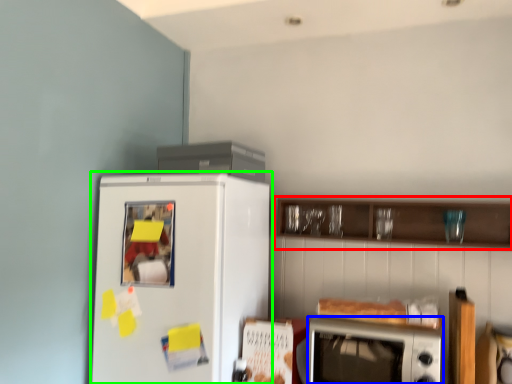
Question: Which is nearer to the cabinetry (highlighted by a red box)? microwave oven (highlighted by a blue box) or refrigerator (highlighted by a green box).

Choices:
 (A) microwave oven
 (B) refrigerator

Answer: (A)